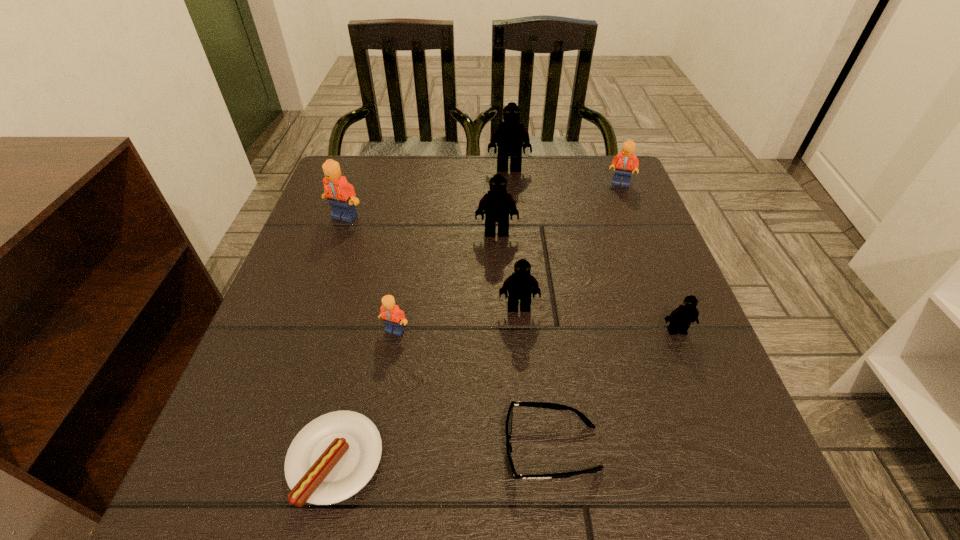
The height and width of the screenshot is (540, 960). I want to click on sausage situated at the left edge, so click(333, 457).

This screenshot has width=960, height=540. In order to click on object positioned at the near left corner in this screenshot , I will do `click(333, 457)`.

This screenshot has width=960, height=540. Identify the location of object that is at the far right corner. (625, 161).

Locate an element on the screen. Image resolution: width=960 pixels, height=540 pixels. vacant space at the far edge is located at coordinates (498, 172).

Identify the location of vacant space at the near edge. The image size is (960, 540). (516, 467).

This screenshot has height=540, width=960. Identify the location of vacant space at the left edge of the desktop. (303, 276).

Identify the location of vacant space at the right edge of the desktop. The width and height of the screenshot is (960, 540). (613, 302).

Locate an element on the screen. The image size is (960, 540). vacant space at the far right corner is located at coordinates (593, 193).

The width and height of the screenshot is (960, 540). Find the location of `blank space at the near right corner`. blank space at the near right corner is located at coordinates (662, 487).

The height and width of the screenshot is (540, 960). In order to click on unoccupied position between the second biggest orange Lego and the nearest black Lego in this screenshot , I will do point(649,257).